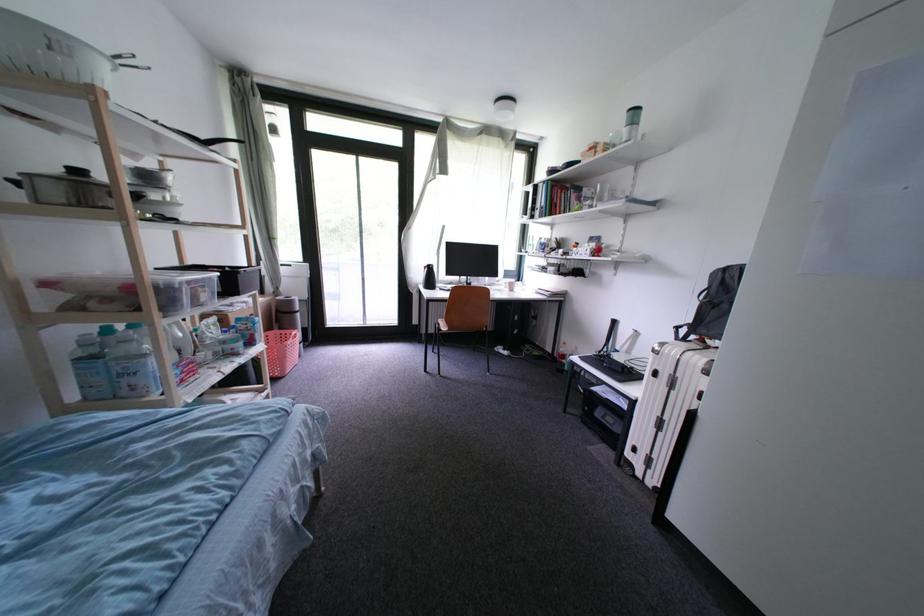
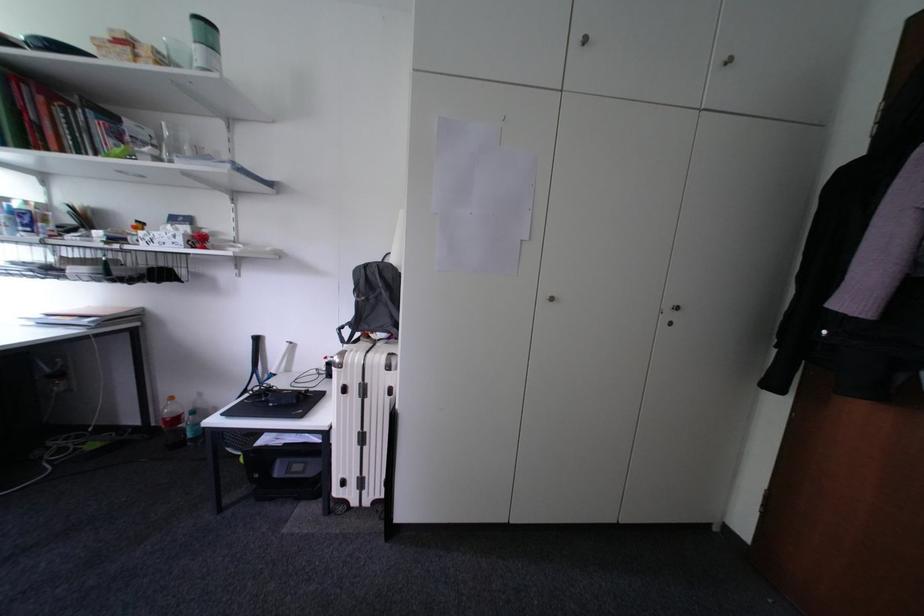
Where in the second image is the point corresponding to [721,277] from the first image?

(363, 274)